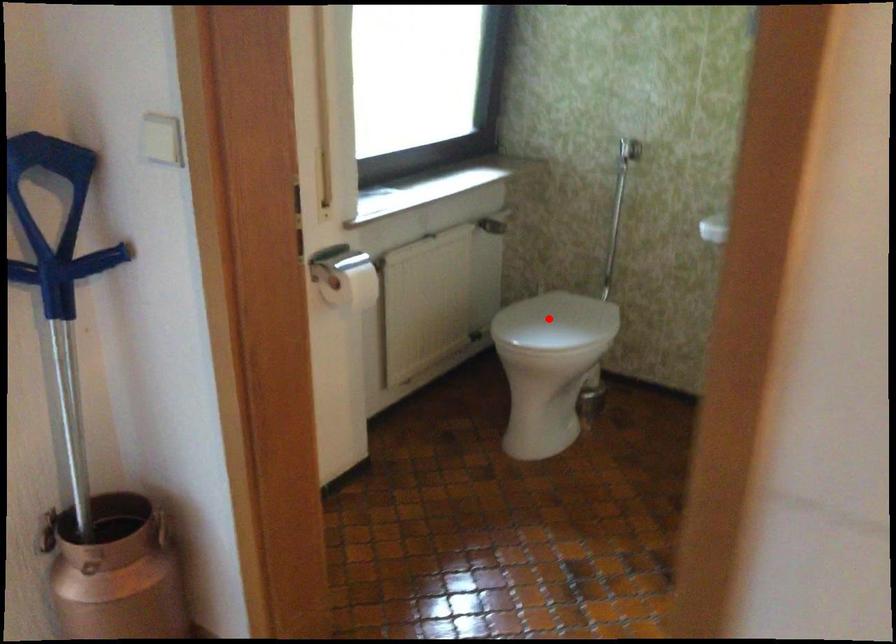
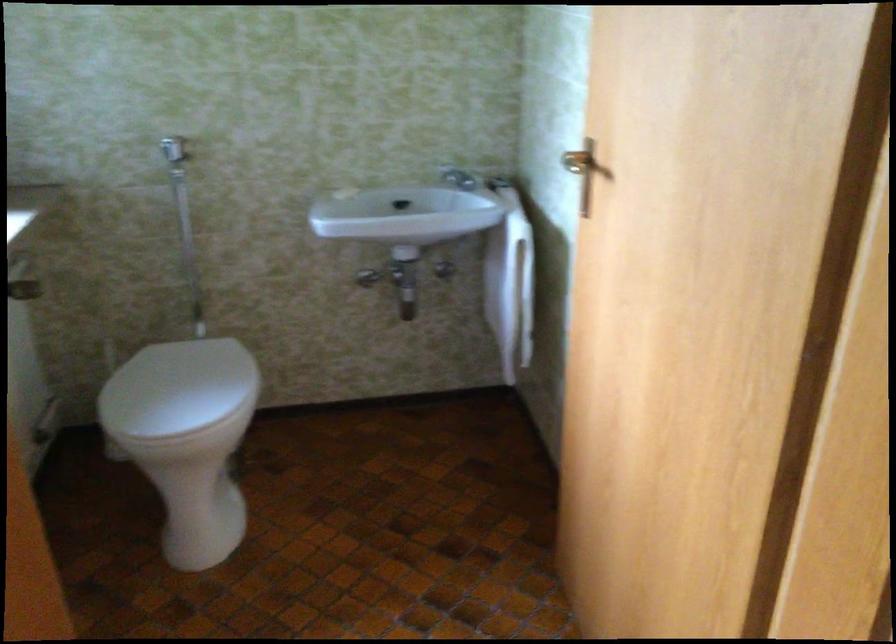
Question: I am providing you with two images of the same scene from different viewpoints. In image1, a red point is highlighted. Considering the same 3D point in image2, which of the following is correct?

Choices:
 (A) It is closer
 (B) It is farther

Answer: (A)